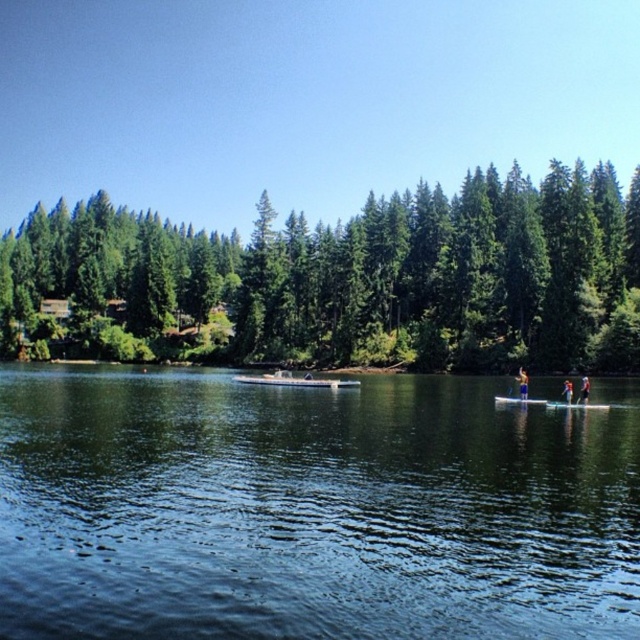
You are planning to take a short swim in the lake. You see the white matte boat at center and the smooth white surfboard at center. Which object is closer to you if you are standing at the shore?

The white matte boat at center is closer to you because the smooth white surfboard at center is behind it.

You are planning to take a photo of the green matte trees at center and the blue fabric surfboard at center from the shore. Which object should you focus on first if you want to capture both in a single frame without moving the camera?

The green matte trees at center are wider than the blue fabric surfboard at center, so you should focus on the green matte trees at center first to ensure they fit within the frame.